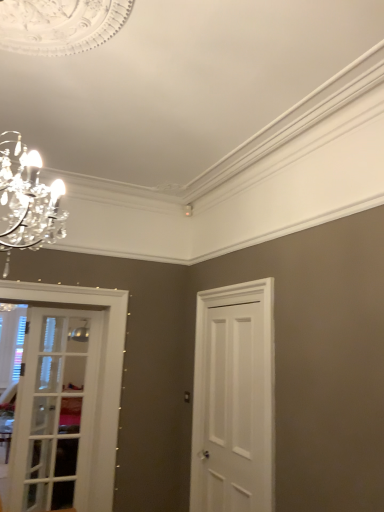
Question: Is white painted wood door at right, which is the second door from left to right, positioned with its back to white glass door at left, which is the 1th door from left to right?

Choices:
 (A) yes
 (B) no

Answer: (B)

Question: Is white painted wood door at right, which is the second door from left to right, at the right side of white glass door at left, which is the 1th door from left to right?

Choices:
 (A) yes
 (B) no

Answer: (A)

Question: From a real-world perspective, does white painted wood door at right, arranged as the 1th door when viewed from the right, stand above white glass door at left, the 2th door from the right?

Choices:
 (A) no
 (B) yes

Answer: (B)

Question: From a real-world perspective, is white painted wood door at right, which is the second door from left to right, positioned under white glass door at left, the 2th door from the right, based on gravity?

Choices:
 (A) no
 (B) yes

Answer: (A)

Question: Is the depth of white painted wood door at right, arranged as the 1th door when viewed from the right, greater than that of white glass door at left, which is the 1th door from left to right?

Choices:
 (A) yes
 (B) no

Answer: (B)

Question: Is white painted wood door at right, arranged as the 1th door when viewed from the right, at the back of white glass door at left, the 2th door from the right?

Choices:
 (A) yes
 (B) no

Answer: (B)

Question: From a real-world perspective, is white glass door at left, the 2th door from the right, physically above white painted wood door at right, arranged as the 1th door when viewed from the right?

Choices:
 (A) no
 (B) yes

Answer: (A)

Question: Is white glass door at left, which is the 1th door from left to right, not inside white painted wood door at right, arranged as the 1th door when viewed from the right?

Choices:
 (A) yes
 (B) no

Answer: (A)

Question: Is white glass door at left, the 2th door from the right, positioned behind white painted wood door at right, which is the second door from left to right?

Choices:
 (A) no
 (B) yes

Answer: (B)

Question: Considering the relative sizes of white glass door at left, the 2th door from the right, and white painted wood door at right, which is the second door from left to right, in the image provided, is white glass door at left, the 2th door from the right, shorter than white painted wood door at right, which is the second door from left to right,?

Choices:
 (A) no
 (B) yes

Answer: (B)

Question: Is white glass door at left, the 2th door from the right, wider than white painted wood door at right, which is the second door from left to right?

Choices:
 (A) no
 (B) yes

Answer: (A)

Question: Is white glass door at left, which is the 1th door from left to right, bigger or smaller than white painted wood door at right, which is the second door from left to right?

Choices:
 (A) big
 (B) small

Answer: (B)